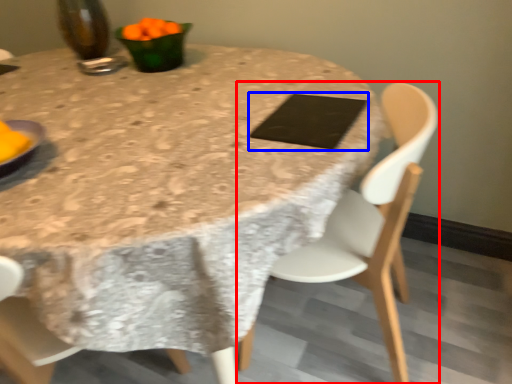
Question: Which of the following is the farthest to the observer, chair (highlighted by a red box) or pad (highlighted by a blue box)?

Choices:
 (A) chair
 (B) pad

Answer: (B)